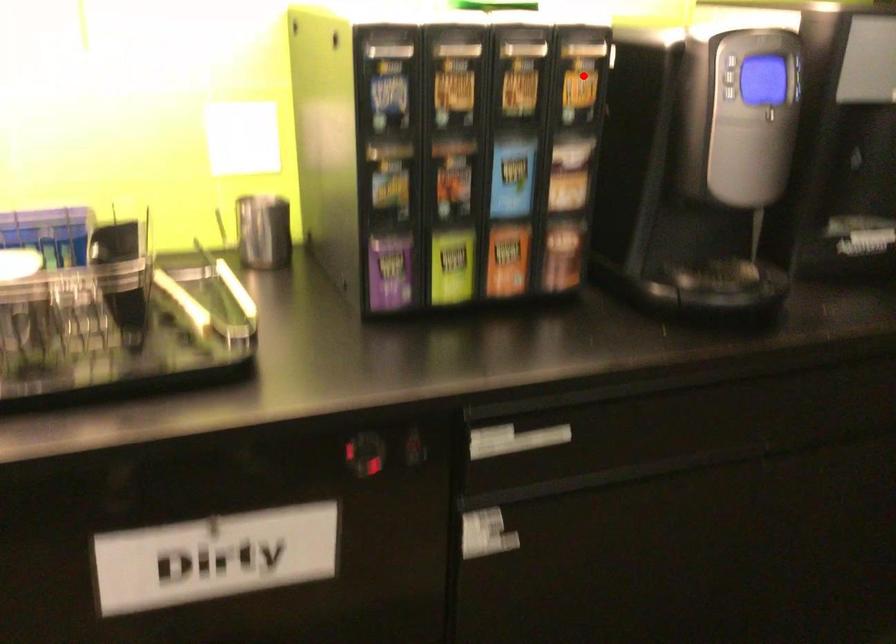
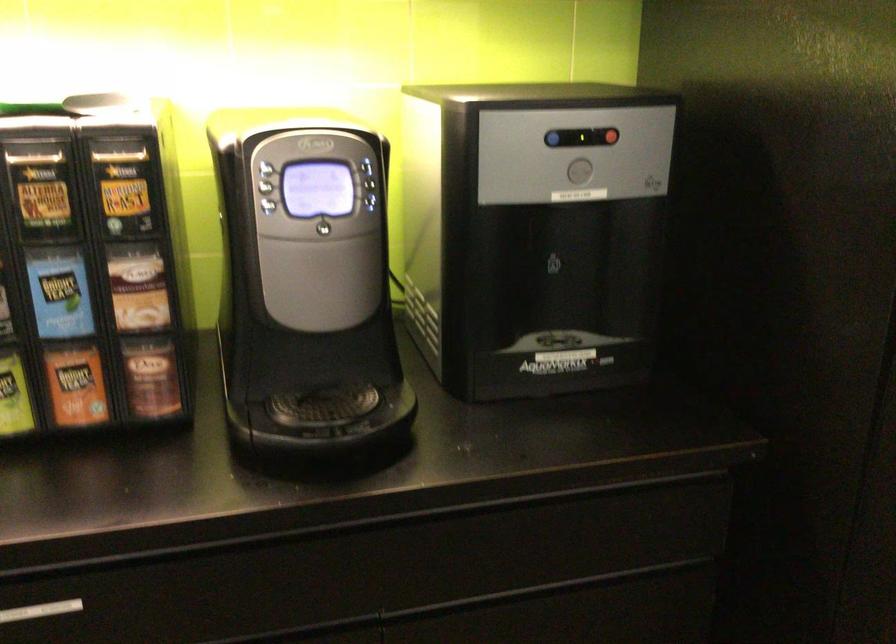
In the second image, find the point that corresponds to the highlighted location in the first image.

(125, 185)